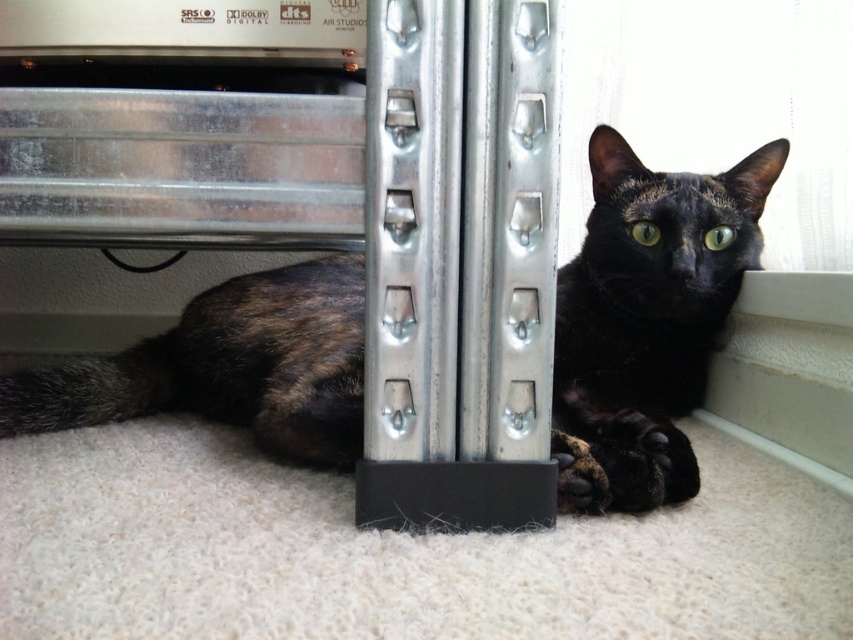
Is point (595, 456) closer to viewer compared to point (569, 435)?

Yes, it is.

Between tortoiseshell fur cat at lower center and black fur at lower center, which one appears on the left side from the viewer's perspective?

From the viewer's perspective, black fur at lower center appears more on the left side.

Which is behind, point (120, 387) or point (582, 445)?

The point (120, 387) is behind.

You are a GUI agent. You are given a task and a screenshot of the screen. Output one action in this format:
    pyautogui.click(x=<x>, y=<y>)
    Task: Click on the tortoiseshell fur cat at lower center
    This screenshot has height=640, width=853.
    Given the screenshot: What is the action you would take?
    pyautogui.click(x=651, y=308)